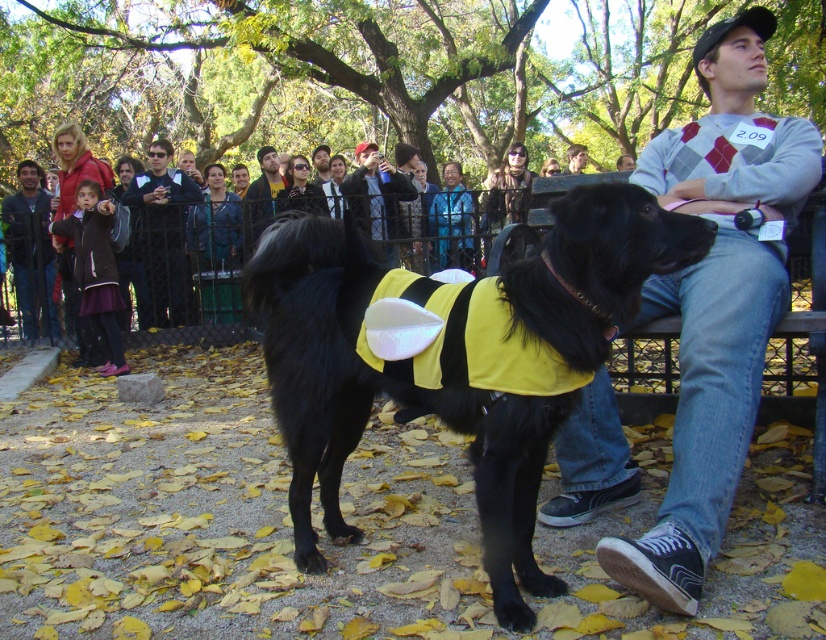
Question: Is yellow fabric dog at center positioned before argyle sweater at center?

Choices:
 (A) yes
 (B) no

Answer: (B)

Question: Which of the following is the closest to the observer?

Choices:
 (A) argyle sweater at center
 (B) yellow fabric dog at center
 (C) matte black jacket at center
 (D) dark brown leather jacket at left

Answer: (A)

Question: Can you confirm if yellow fabric dog at center is wider than argyle sweater at center?

Choices:
 (A) yes
 (B) no

Answer: (A)

Question: Which point is farther to the camera?

Choices:
 (A) (380, 157)
 (B) (330, 300)
 (C) (178, 227)

Answer: (A)

Question: Is yellow fabric dog at center below dark brown leather jacket at left?

Choices:
 (A) no
 (B) yes

Answer: (B)

Question: Which point is farther from the camera taking this photo?

Choices:
 (A) (733, 476)
 (B) (336, 353)
 (C) (22, 212)

Answer: (C)